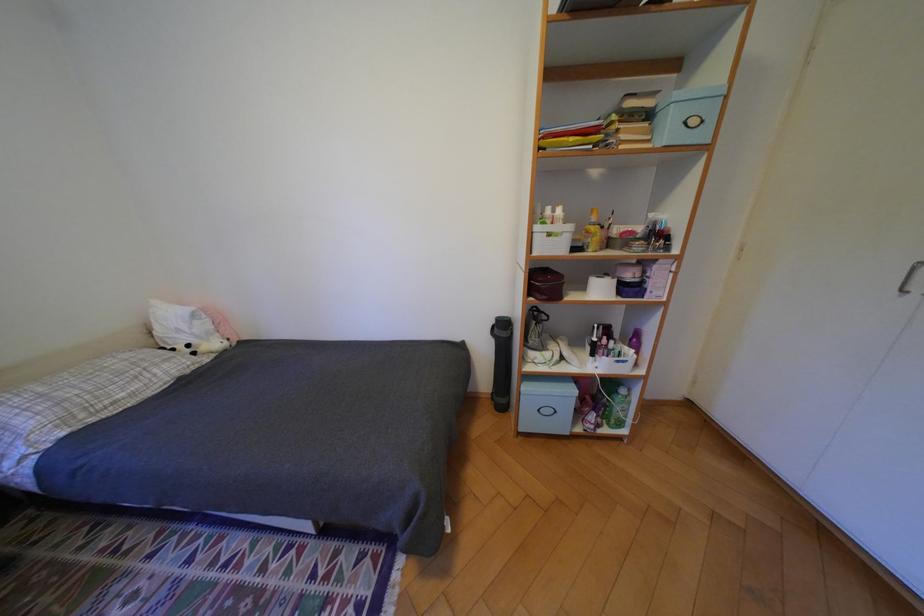
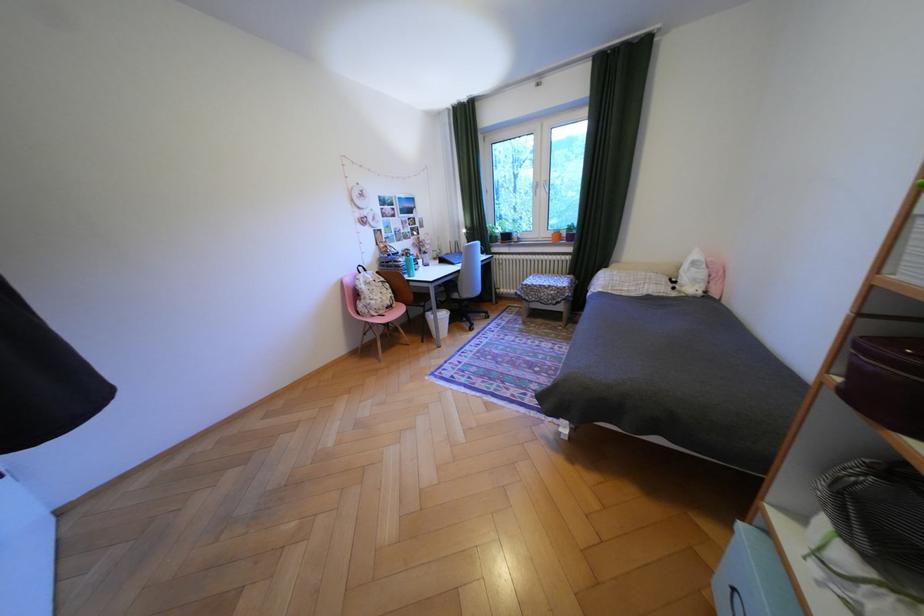
Locate, in the second image, the point that corresponds to (238,342) in the first image.

(712, 293)